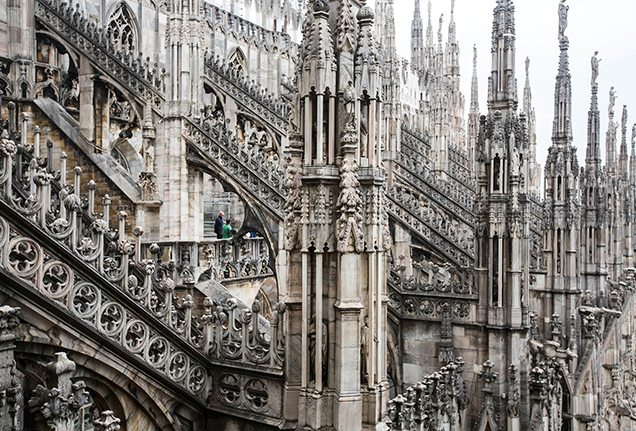
The image size is (636, 431). Identify the location of stairway. (88, 301).